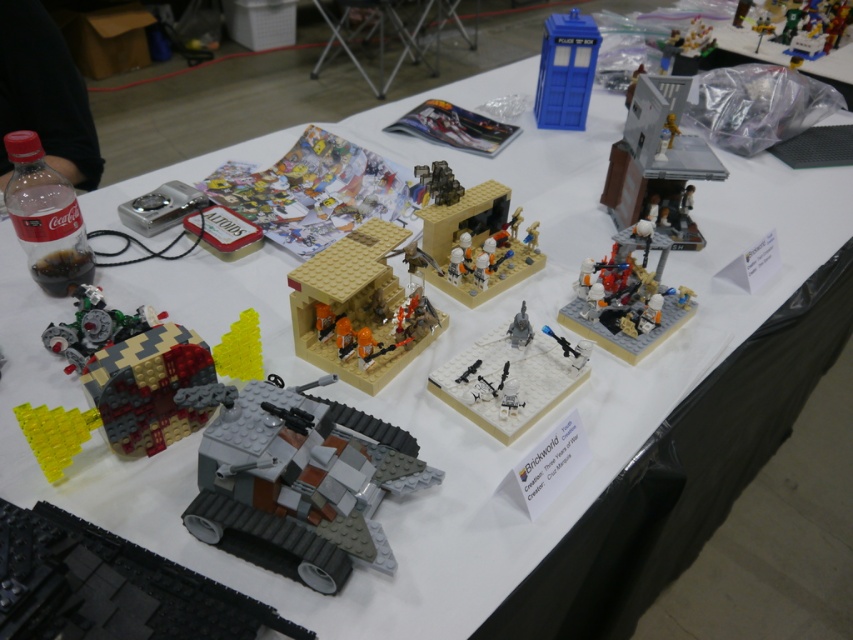
In the scene shown: Who is positioned more to the right, tan matte building at center or satin silver tank at center?

satin silver tank at center

Is point (370, 307) less distant than point (525, 342)?

No, (370, 307) is further to viewer.

What do you see at coordinates (358, 305) in the screenshot? The image size is (853, 640). I see `tan matte building at center` at bounding box center [358, 305].

The height and width of the screenshot is (640, 853). In order to click on tan matte building at center in this screenshot , I will do `click(358, 305)`.

Does point (138, 394) lie behind point (654, 173)?

No, it is in front of (654, 173).

Find the location of `brick-patterned cube at center`. brick-patterned cube at center is located at coordinates (148, 387).

Can you confirm if gray matte tank at lower left is positioned to the left of cartoon paper at upper center?

Yes, gray matte tank at lower left is to the left of cartoon paper at upper center.

Identify the location of gray matte tank at lower left. This screenshot has height=640, width=853. (109, 586).

Where is `gray matte tank at lower left`? Image resolution: width=853 pixels, height=640 pixels. gray matte tank at lower left is located at coordinates (109, 586).